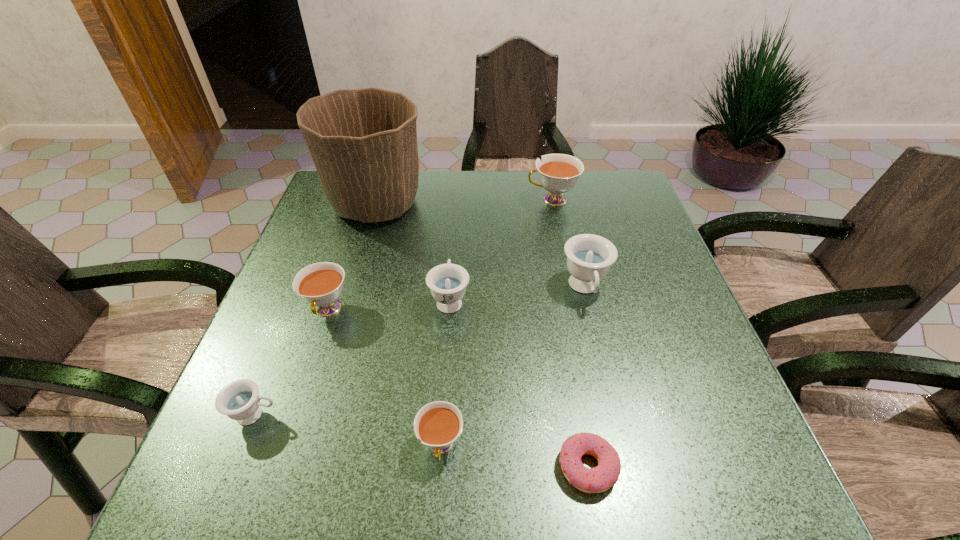
What are the coordinates of `free point located on the side of the second blue teacup from right to left with the handle` in the screenshot? It's located at (457, 191).

Where is `free location located 0.050m on the side of the second blue teacup from right to left with the handle`? free location located 0.050m on the side of the second blue teacup from right to left with the handle is located at coordinates (452, 267).

Locate an element on the screen. free location located on the side of the second white teacup from right to left with the handle is located at coordinates (437, 505).

You are a GUI agent. You are given a task and a screenshot of the screen. Output one action in this format:
    pyautogui.click(x=<x>, y=<y>)
    Task: Click on the vacant region located 0.260m on the side of the smallest blue teacup with the handle
    The image size is (960, 540).
    Given the screenshot: What is the action you would take?
    pyautogui.click(x=426, y=415)

This screenshot has width=960, height=540. What are the coordinates of `vacant area located on the back of the pink doughnut` in the screenshot? It's located at (564, 329).

What are the coordinates of `flowerpot that is at the far edge` in the screenshot? It's located at (363, 142).

In order to click on teacup at the far edge in this screenshot , I will do `click(558, 173)`.

I want to click on teacup located at the near edge, so click(x=438, y=424).

Locate an element on the screen. doughnut that is at the near edge is located at coordinates coord(600,478).

At what (x,y) coordinates should I click in order to perform the action: click on flowerpot present at the left edge. Please return your answer as a coordinate pair (x, y). The image size is (960, 540). Looking at the image, I should click on (363, 142).